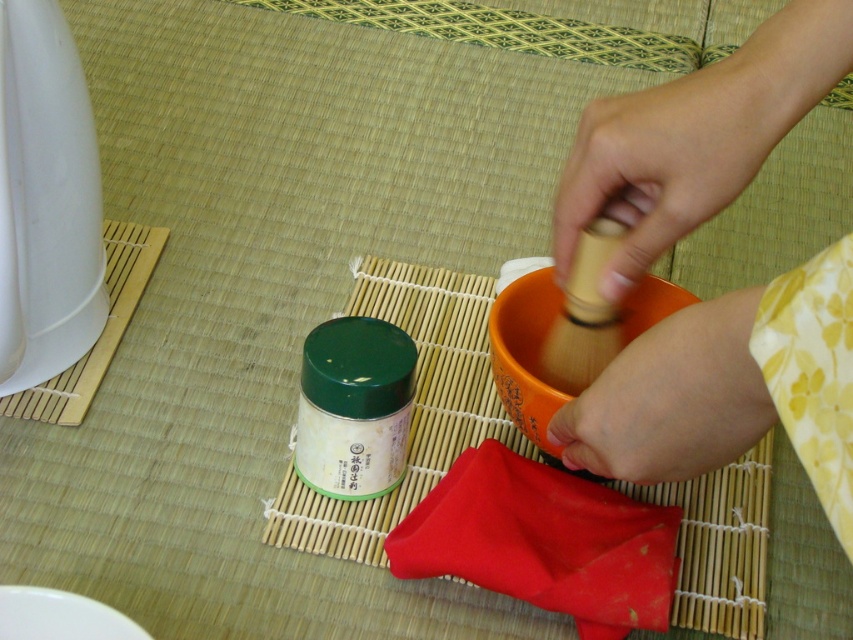
Question: Which of the following is the closest to the observer?

Choices:
 (A) (566, 177)
 (B) (747, 401)

Answer: (B)

Question: Does wooden rolling pin at upper center appear over wooden whisk at center?

Choices:
 (A) no
 (B) yes

Answer: (B)

Question: Is wooden rolling pin at upper center bigger than wooden whisk at center?

Choices:
 (A) no
 (B) yes

Answer: (B)

Question: Based on their relative distances, which object is farther from the wooden rolling pin at upper right?

Choices:
 (A) wooden rolling pin at upper center
 (B) wooden whisk at center

Answer: (A)

Question: Which of the following is the closest to the observer?

Choices:
 (A) (846, 444)
 (B) (753, 376)

Answer: (A)

Question: Does wooden rolling pin at upper right lie in front of wooden rolling pin at upper center?

Choices:
 (A) no
 (B) yes

Answer: (B)